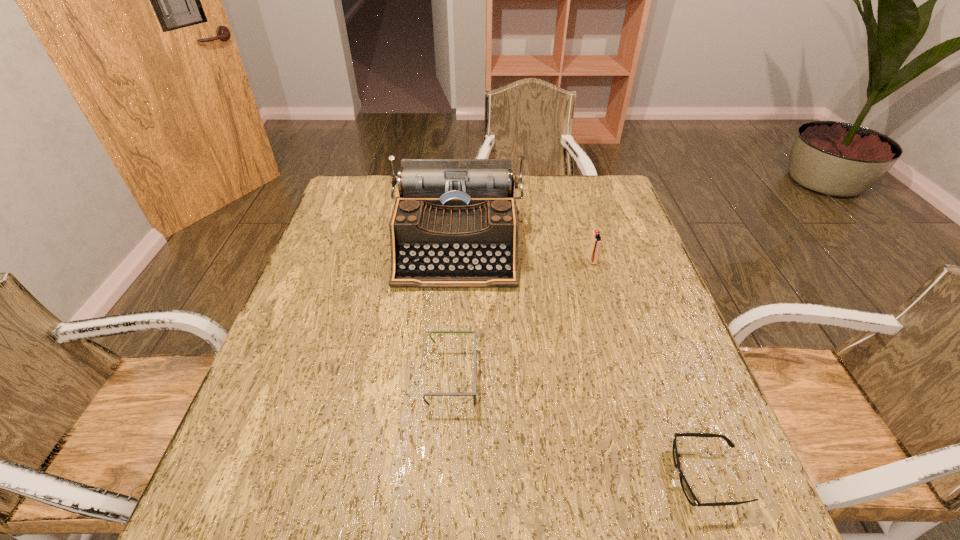
What are the coordinates of `free space at the left edge of the desktop` in the screenshot? It's located at (353, 232).

Identify the location of free space at the right edge of the desktop. This screenshot has width=960, height=540. (587, 233).

In the image, there is a desktop. Identify the location of vacant space at the far left corner. (372, 185).

The width and height of the screenshot is (960, 540). I want to click on free spot between the second tallest object and the second shortest object, so click(x=522, y=319).

Locate an element on the screen. The width and height of the screenshot is (960, 540). free space between the second object from right to left and the third farthest object is located at coordinates (522, 319).

This screenshot has width=960, height=540. I want to click on unoccupied position between the second tallest object and the typewriter, so click(x=524, y=254).

Find the location of a particular element. The width and height of the screenshot is (960, 540). free space between the rightmost object and the second shortest object is located at coordinates (580, 427).

Where is `free space between the sunglasses and the second tallest object`? Image resolution: width=960 pixels, height=540 pixels. free space between the sunglasses and the second tallest object is located at coordinates (650, 369).

Identify the location of vacant space that's between the third object from left to right and the typewriter. This screenshot has height=540, width=960. (524, 254).

The height and width of the screenshot is (540, 960). Find the location of `free spot between the shortest object and the igniter`. free spot between the shortest object and the igniter is located at coordinates (650, 369).